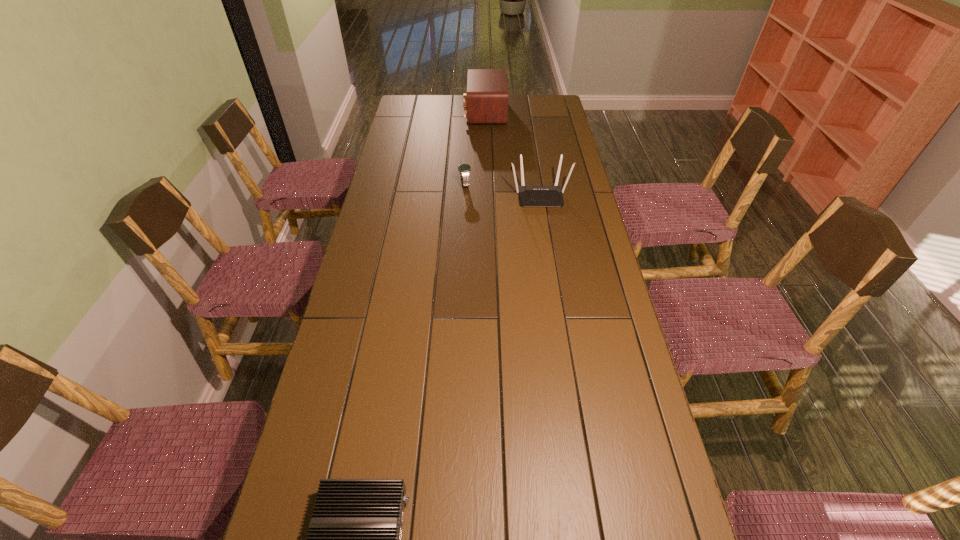
I want to click on object that is the nearest to the taller router, so click(x=464, y=169).